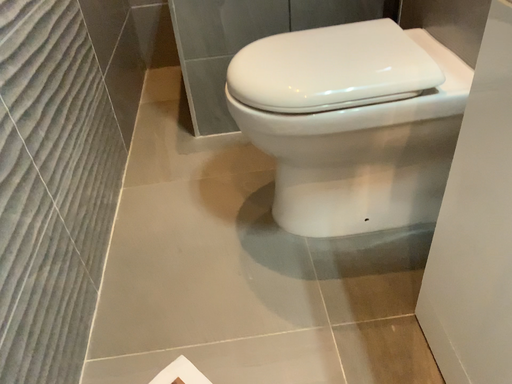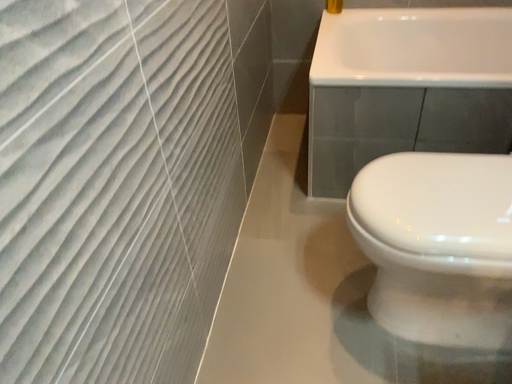
Question: Which way did the camera rotate in the video?

Choices:
 (A) rotated left
 (B) rotated right

Answer: (A)